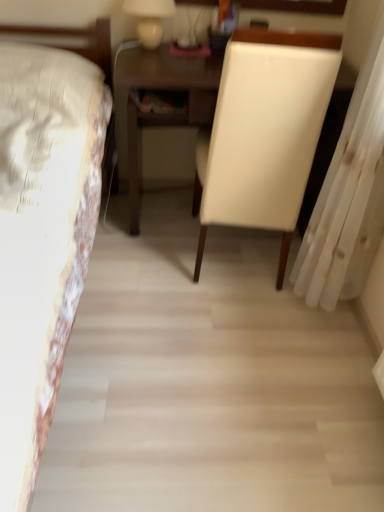
Identify the location of vacant area to the left of white sheer curtain at right. This screenshot has width=384, height=512. (253, 331).